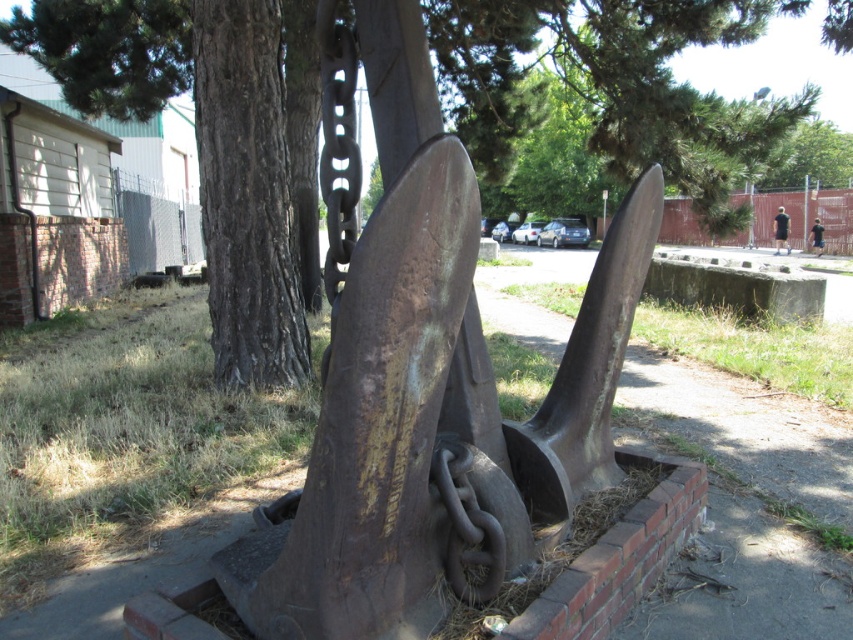
Question: Where is rusty metal anchor at center located in relation to green leafy tree at upper center in the image?

Choices:
 (A) above
 (B) below

Answer: (B)

Question: Which point is farther to the camera?

Choices:
 (A) (355, 257)
 (B) (781, 160)

Answer: (B)

Question: Which object is farther from the camera taking this photo?

Choices:
 (A) green leafy tree at upper center
 (B) rusty metal anchor at center

Answer: (A)

Question: Which point is farther from the camera taking this photo?

Choices:
 (A) (358, 387)
 (B) (793, 179)

Answer: (B)

Question: Can you confirm if rusty metal anchor at center is positioned above green leafy tree at upper center?

Choices:
 (A) no
 (B) yes

Answer: (A)

Question: Is rusty metal anchor at center smaller than green leafy tree at upper center?

Choices:
 (A) no
 (B) yes

Answer: (B)